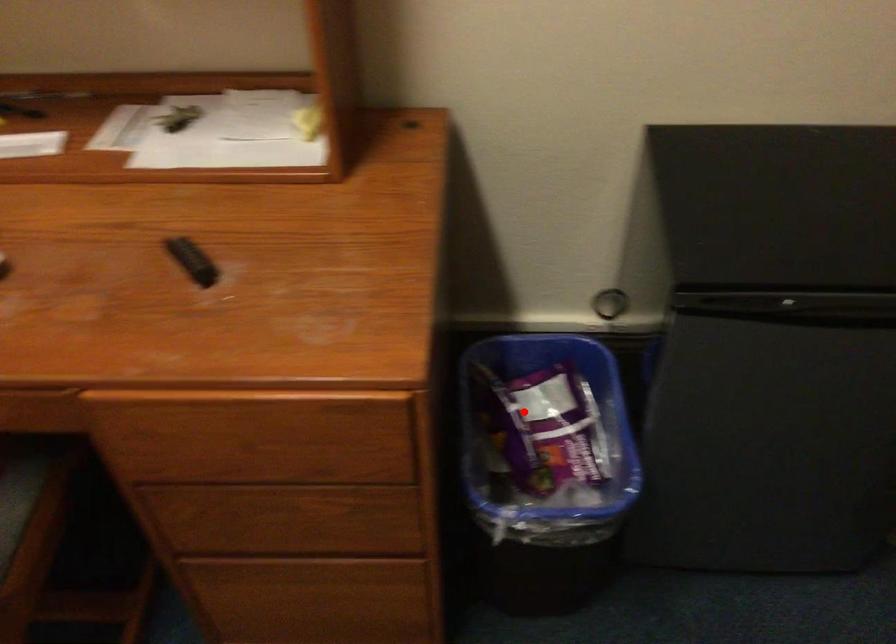
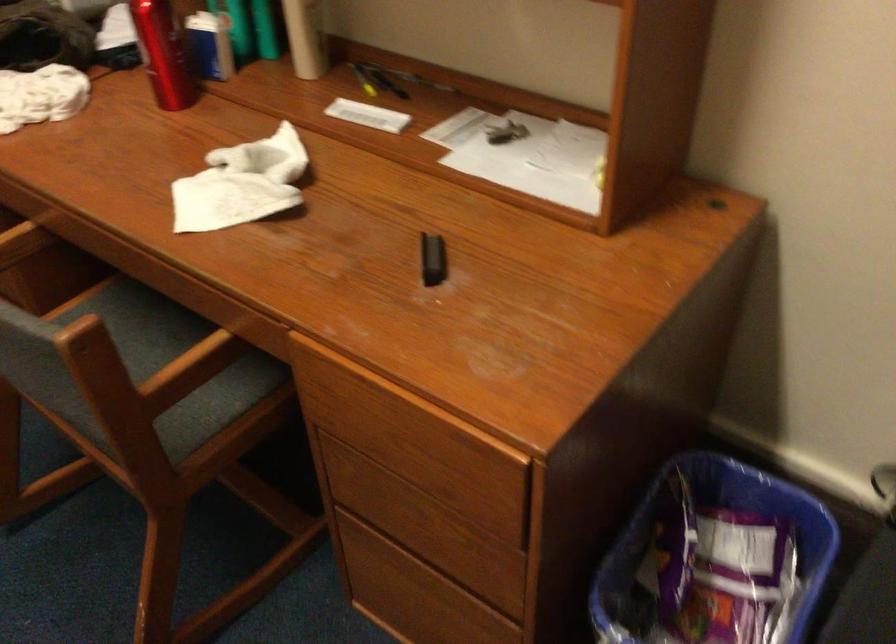
Where in the second image is the point corresponding to the highlighted location from the first image?

(711, 542)